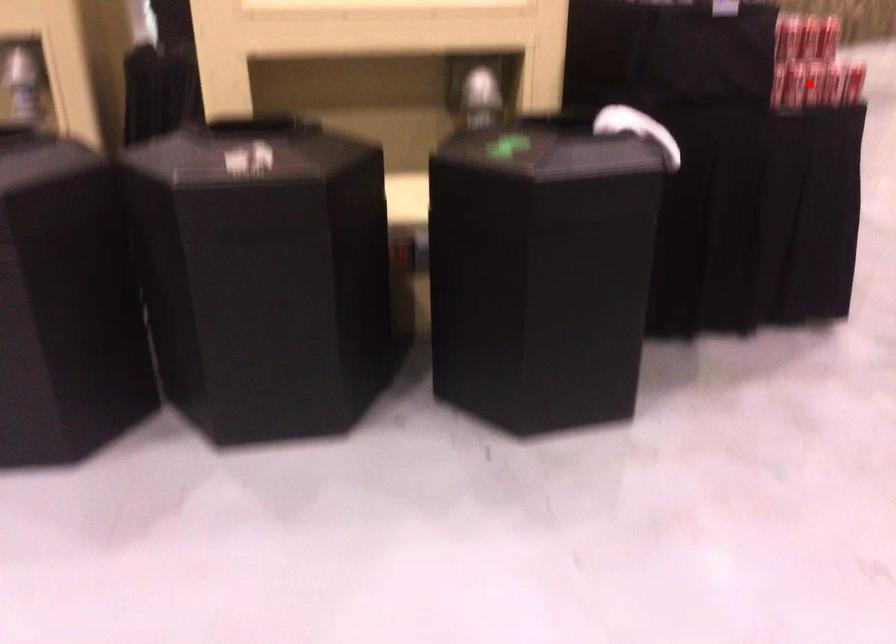
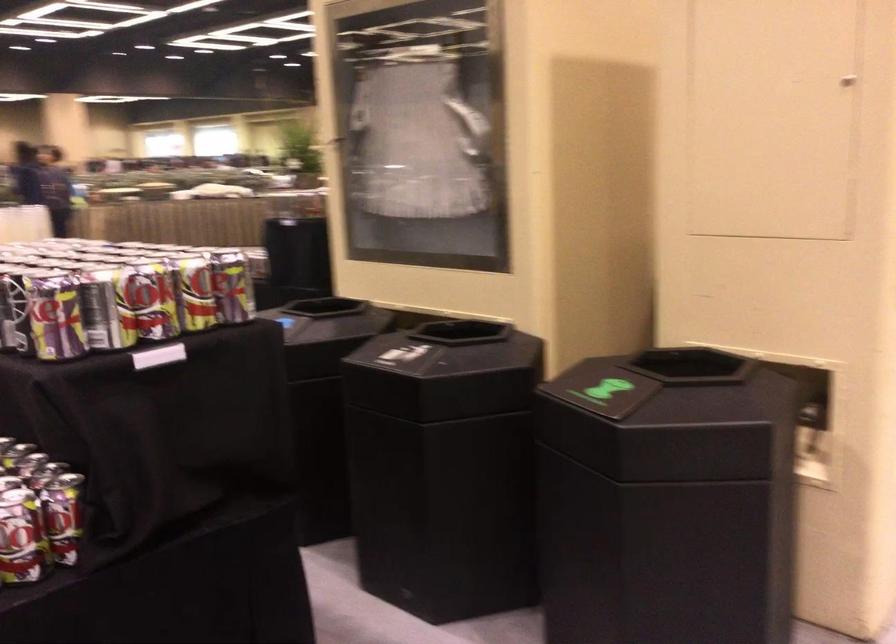
Question: I am providing you with two images of the same scene from different viewpoints. A red point is marked on the first image. At the location where the point appears in image 1, is it still visible in image 2?

Choices:
 (A) Yes
 (B) No

Answer: (B)